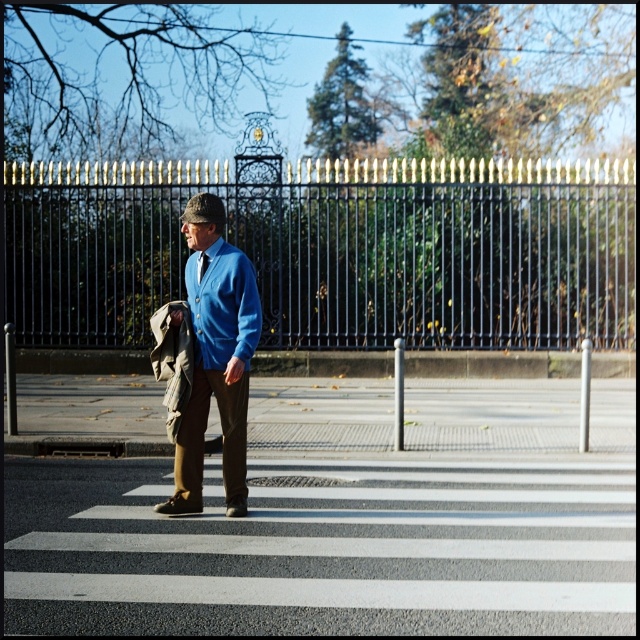
Question: Which point is farther to the camera?

Choices:
 (A) (244, 280)
 (B) (204, 257)
 (C) (208, 333)

Answer: (B)

Question: Where is blue smooth dress shirt at center located in relation to blue silk tie at center in the image?

Choices:
 (A) above
 (B) below

Answer: (B)

Question: Which of these objects is positioned farthest from the matte blue sweater at center?

Choices:
 (A) blue smooth dress shirt at center
 (B) blue silk tie at center

Answer: (B)

Question: Considering the relative positions of matte blue sweater at center and blue smooth dress shirt at center in the image provided, where is matte blue sweater at center located with respect to blue smooth dress shirt at center?

Choices:
 (A) left
 (B) right

Answer: (A)

Question: Is matte blue sweater at center wider than blue silk tie at center?

Choices:
 (A) no
 (B) yes

Answer: (B)

Question: Considering the real-world distances, which object is farthest from the blue silk tie at center?

Choices:
 (A) blue smooth dress shirt at center
 (B) matte blue sweater at center

Answer: (B)